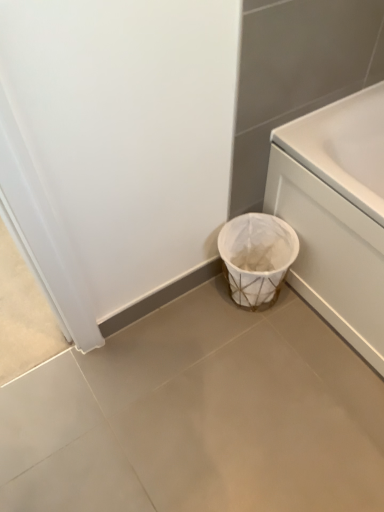
At what (x,y) coordinates should I click in order to perform the action: click on free point above white matte trash can at lower right (from a real-world perspective). Please return your answer as a coordinate pair (x, y). This screenshot has height=512, width=384. Looking at the image, I should click on (201, 413).